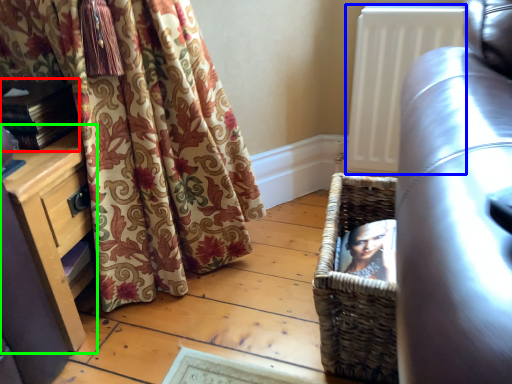
Question: Considering the real-world distances, which object is farthest from book (highlighted by a red box)? radiator (highlighted by a blue box) or dresser (highlighted by a green box)?

Choices:
 (A) radiator
 (B) dresser

Answer: (A)